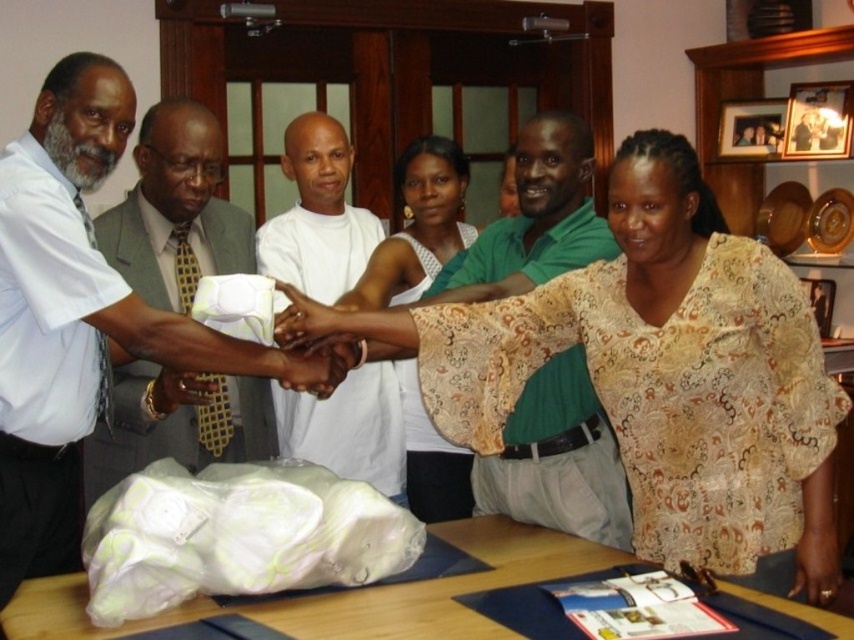
Consider the image. Who is higher up, white matte shirt at center or white lace blouse at center?

white lace blouse at center is above.

Based on the photo, can you confirm if white matte shirt at center is shorter than white lace blouse at center?

Correct, white matte shirt at center is not as tall as white lace blouse at center.

Is point (4, 182) positioned in front of point (408, 406)?

That is True.

This screenshot has width=854, height=640. I want to click on white matte shirt at center, so click(72, 316).

Can you confirm if white matte shirt at center is thinner than wooden table at lower center?

Indeed, white matte shirt at center has a lesser width compared to wooden table at lower center.

Which is above, white matte shirt at center or wooden table at lower center?

white matte shirt at center is higher up.

Is point (91, 120) closer to camera compared to point (484, 628)?

No.

You are a GUI agent. You are given a task and a screenshot of the screen. Output one action in this format:
    pyautogui.click(x=<x>, y=<y>)
    Task: Click on the white matte shirt at center
    This screenshot has height=640, width=854.
    Given the screenshot: What is the action you would take?
    point(72,316)

In the scene shown: Can you confirm if light brown suit jacket at left is positioned to the right of smooth skin handshake at center?

In fact, light brown suit jacket at left is to the left of smooth skin handshake at center.

Does light brown suit jacket at left have a lesser height compared to smooth skin handshake at center?

No.

Does point (106, 452) lie behind point (287, 372)?

Yes.

Where is `light brown suit jacket at left`? The width and height of the screenshot is (854, 640). light brown suit jacket at left is located at coordinates (174, 209).